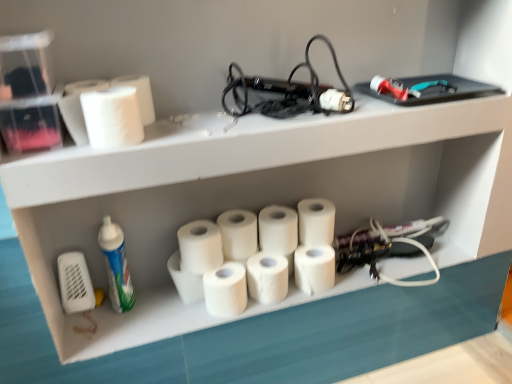
Question: Could white matte paper towel at center, which appears as the eighth paper towel when viewed from the left, be considered to be inside white matte paper towel at center, the 8th paper towel in the right-to-left sequence?

Choices:
 (A) yes
 (B) no

Answer: (B)

Question: Is white matte paper towel at center, the third paper towel when ordered from left to right, oriented away from white matte paper towel at center, which ranks as the 3th paper towel in right-to-left order?

Choices:
 (A) no
 (B) yes

Answer: (A)

Question: Can you confirm if white matte paper towel at center, the third paper towel when ordered from left to right, is wider than white matte paper towel at center, which ranks as the 3th paper towel in right-to-left order?

Choices:
 (A) yes
 (B) no

Answer: (A)

Question: From the image's perspective, is white matte paper towel at center, the third paper towel when ordered from left to right, over white matte paper towel at center, which appears as the eighth paper towel when viewed from the left?

Choices:
 (A) no
 (B) yes

Answer: (A)

Question: Is white matte paper towel at center, the third paper towel when ordered from left to right, directly adjacent to white matte paper towel at center, which appears as the eighth paper towel when viewed from the left?

Choices:
 (A) no
 (B) yes

Answer: (A)

Question: Is white matte toilet paper at upper left inside or outside of white matte paper towel at upper left, the second paper towel positioned from the left?

Choices:
 (A) outside
 (B) inside

Answer: (A)

Question: Considering the positions of white matte toilet paper at upper left and white matte paper towel at upper left, the 9th paper towel positioned from the right, in the image, is white matte toilet paper at upper left bigger or smaller than white matte paper towel at upper left, the 9th paper towel positioned from the right,?

Choices:
 (A) small
 (B) big

Answer: (B)

Question: Is white matte toilet paper at upper left taller or shorter than white matte paper towel at upper left, the second paper towel positioned from the left?

Choices:
 (A) tall
 (B) short

Answer: (A)

Question: Considering their positions, is white matte toilet paper at upper left located in front of or behind white matte paper towel at upper left, the 9th paper towel positioned from the right?

Choices:
 (A) front
 (B) behind

Answer: (A)

Question: Is point (215, 238) positioned closer to the camera than point (266, 291)?

Choices:
 (A) farther
 (B) closer

Answer: (B)

Question: Is white matte paper towel at center, arranged as the seventh paper towel when viewed from the right, spatially inside white matte paper towel at center, acting as the 7th paper towel starting from the left, or outside of it?

Choices:
 (A) outside
 (B) inside

Answer: (A)

Question: Considering the positions of white matte paper towel at center, the fourth paper towel viewed from the left, and white matte paper towel at center, acting as the 7th paper towel starting from the left, in the image, is white matte paper towel at center, the fourth paper towel viewed from the left, wider or thinner than white matte paper towel at center, acting as the 7th paper towel starting from the left,?

Choices:
 (A) thin
 (B) wide

Answer: (B)

Question: Relative to white matte paper towel at center, acting as the 7th paper towel starting from the left, is white matte paper towel at center, the fourth paper towel viewed from the left, in front or behind?

Choices:
 (A) front
 (B) behind

Answer: (A)

Question: Considering the positions of point (136, 140) and point (242, 299), is point (136, 140) closer or farther from the camera than point (242, 299)?

Choices:
 (A) farther
 (B) closer

Answer: (B)

Question: In the image, is white matte paper towel at upper left, arranged as the first paper towel when viewed from the left, on the left side or the right side of white matte paper towel at center, arranged as the sixth paper towel when viewed from the right?

Choices:
 (A) left
 (B) right

Answer: (A)